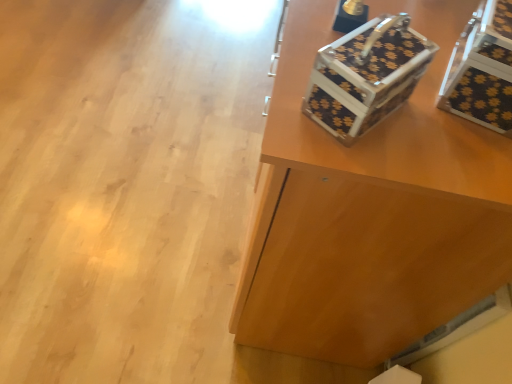
Question: From a real-world perspective, is metallic floral-patterned shoe box at upper right physically below black textured storage box at upper right?

Choices:
 (A) yes
 (B) no

Answer: (A)

Question: Can you confirm if metallic floral-patterned shoe box at upper right is wider than black textured storage box at upper right?

Choices:
 (A) yes
 (B) no

Answer: (B)

Question: Does metallic floral-patterned shoe box at upper right appear on the right side of black textured storage box at upper right?

Choices:
 (A) yes
 (B) no

Answer: (B)

Question: Is metallic floral-patterned shoe box at upper right behind black textured storage box at upper right?

Choices:
 (A) yes
 (B) no

Answer: (B)

Question: Is black textured storage box at upper right located within metallic floral-patterned shoe box at upper right?

Choices:
 (A) no
 (B) yes

Answer: (A)

Question: From their relative heights in the image, would you say metallic floral-patterned shoe box at upper right is taller or shorter than black textured storage box at upper right?

Choices:
 (A) tall
 (B) short

Answer: (B)

Question: From the image's perspective, is metallic floral-patterned shoe box at upper right positioned above or below black textured storage box at upper right?

Choices:
 (A) below
 (B) above

Answer: (A)

Question: From a real-world perspective, relative to black textured storage box at upper right, is metallic floral-patterned shoe box at upper right vertically above or below?

Choices:
 (A) above
 (B) below

Answer: (B)

Question: Is metallic floral-patterned shoe box at upper right inside or outside of black textured storage box at upper right?

Choices:
 (A) outside
 (B) inside

Answer: (A)

Question: Considering the positions of point (325, 334) and point (493, 51), is point (325, 334) closer or farther from the camera than point (493, 51)?

Choices:
 (A) closer
 (B) farther

Answer: (B)

Question: From a real-world perspective, relative to black textured storage box at upper right, is black textured suitcase at upper right vertically above or below?

Choices:
 (A) above
 (B) below

Answer: (B)

Question: Would you say black textured suitcase at upper right is inside or outside black textured storage box at upper right?

Choices:
 (A) outside
 (B) inside

Answer: (A)

Question: From the image's perspective, relative to black textured storage box at upper right, is black textured suitcase at upper right above or below?

Choices:
 (A) above
 (B) below

Answer: (A)

Question: Relative to metallic floral-patterned shoe box at upper right, is black textured suitcase at upper right in front or behind?

Choices:
 (A) behind
 (B) front

Answer: (A)

Question: Considering the positions of point (482, 150) and point (404, 26), is point (482, 150) closer or farther from the camera than point (404, 26)?

Choices:
 (A) farther
 (B) closer

Answer: (A)